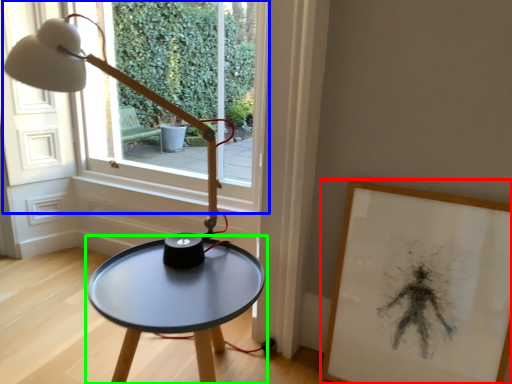
Question: Based on their relative distances, which object is farther from picture frame (highlighted by a red box)? Choose from window (highlighted by a blue box) and table (highlighted by a green box).

Choices:
 (A) window
 (B) table

Answer: (A)